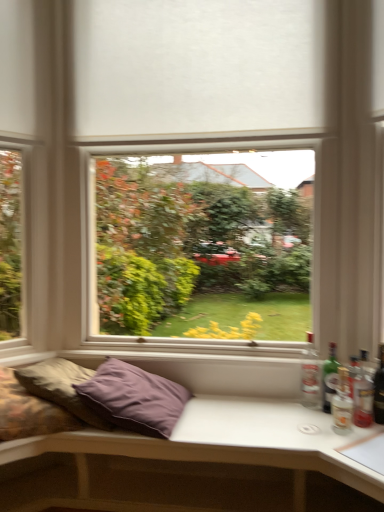
Question: Is green glass bottle at right, placed as the 2th bottle when sorted from front to back, bigger than clear glass bottle at right, marked as the 1th bottle in a left-to-right arrangement?

Choices:
 (A) no
 (B) yes

Answer: (A)

Question: Is green glass bottle at right, the second bottle from the left, wider than clear glass bottle at right, which ranks as the third bottle in right-to-left order?

Choices:
 (A) yes
 (B) no

Answer: (B)

Question: Is green glass bottle at right, arranged as the 2th bottle when viewed from the right, directly adjacent to clear glass bottle at right, which ranks as the third bottle in right-to-left order?

Choices:
 (A) yes
 (B) no

Answer: (A)

Question: Does green glass bottle at right, arranged as the 2th bottle when viewed from the right, come in front of clear glass bottle at right, marked as the 1th bottle in a left-to-right arrangement?

Choices:
 (A) yes
 (B) no

Answer: (A)

Question: Considering the relative sizes of green glass bottle at right, placed as the 2th bottle when sorted from front to back, and clear glass bottle at right, which is the first bottle from back to front, in the image provided, is green glass bottle at right, placed as the 2th bottle when sorted from front to back, shorter than clear glass bottle at right, which is the first bottle from back to front,?

Choices:
 (A) no
 (B) yes

Answer: (B)

Question: Considering the positions of point (354, 394) and point (326, 367), is point (354, 394) closer or farther from the camera than point (326, 367)?

Choices:
 (A) farther
 (B) closer

Answer: (B)

Question: Based on their positions, is translucent glass bottle at right, which is the third bottle from back to front, located to the left or right of green glass bottle at right, the second bottle from the left?

Choices:
 (A) right
 (B) left

Answer: (A)

Question: From the image's perspective, is translucent glass bottle at right, the first bottle viewed from the right, located above or below green glass bottle at right, arranged as the 2th bottle when viewed from the right?

Choices:
 (A) below
 (B) above

Answer: (A)

Question: From a real-world perspective, is translucent glass bottle at right, placed as the 3th bottle when sorted from left to right, positioned above or below green glass bottle at right, the second bottle from the left?

Choices:
 (A) above
 (B) below

Answer: (B)

Question: Is clear glass bottle at right, the 3th bottle viewed from the front, in front of or behind translucent glass bottle at right, the first bottle viewed from the right, in the image?

Choices:
 (A) front
 (B) behind

Answer: (B)

Question: Considering the positions of point (304, 373) and point (357, 397), is point (304, 373) closer or farther from the camera than point (357, 397)?

Choices:
 (A) farther
 (B) closer

Answer: (A)

Question: From their relative heights in the image, would you say clear glass bottle at right, which ranks as the third bottle in right-to-left order, is taller or shorter than translucent glass bottle at right, which is the third bottle from back to front?

Choices:
 (A) tall
 (B) short

Answer: (A)

Question: Would you say clear glass bottle at right, the 3th bottle viewed from the front, is to the left or to the right of translucent glass bottle at right, which is the third bottle from back to front, in the picture?

Choices:
 (A) left
 (B) right

Answer: (A)

Question: Is clear glass bottle at right, the 3th bottle viewed from the front, taller or shorter than purple fabric studio couch at lower center?

Choices:
 (A) short
 (B) tall

Answer: (A)

Question: From a real-world perspective, is clear glass bottle at right, marked as the 1th bottle in a left-to-right arrangement, physically located above or below purple fabric studio couch at lower center?

Choices:
 (A) above
 (B) below

Answer: (A)